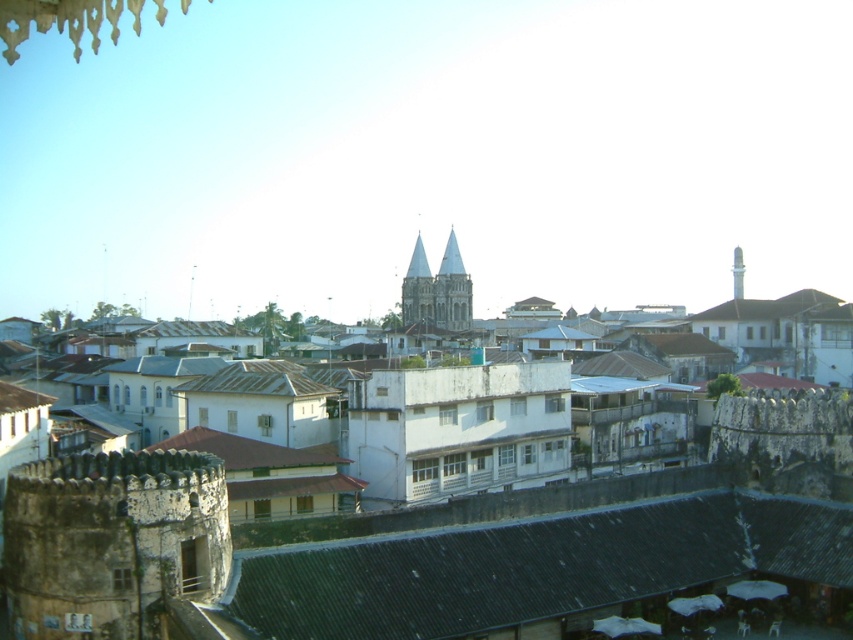
Can you confirm if brown corrugated metal roof at center is positioned to the right of white corrugated metal roof at center?

No, brown corrugated metal roof at center is not to the right of white corrugated metal roof at center.

Who is more distant from viewer, (316, 445) or (250, 372)?

Positioned behind is point (250, 372).

Is point (163, 440) positioned in front of point (326, 388)?

No, (163, 440) is further to viewer.

Identify the location of brown corrugated metal roof at center. This screenshot has height=640, width=853. (247, 451).

Which is more to the right, dark gray corrugated metal roof at center or white corrugated metal roof at center?

From the viewer's perspective, dark gray corrugated metal roof at center appears more on the right side.

This screenshot has height=640, width=853. Describe the element at coordinates (567, 573) in the screenshot. I see `dark gray corrugated metal roof at center` at that location.

Find the location of a particular element. dark gray corrugated metal roof at center is located at coordinates (567, 573).

This screenshot has height=640, width=853. I want to click on brown corrugated metal roof at center, so click(247, 451).

Does brown corrugated metal roof at center come in front of white stone spire at upper center?

Yes, brown corrugated metal roof at center is closer to the viewer.

At what (x,y) coordinates should I click in order to perform the action: click on brown corrugated metal roof at center. Please return your answer as a coordinate pair (x, y). Looking at the image, I should click on (247, 451).